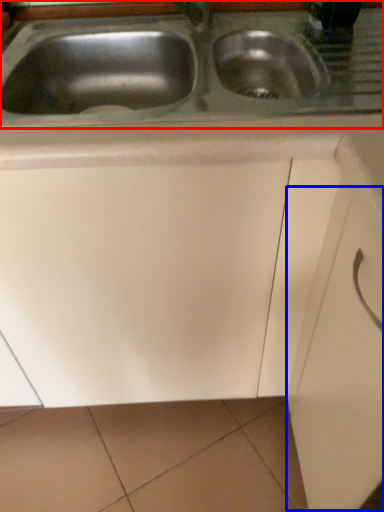
Question: Which of the following is the farthest to the observer, sink (highlighted by a red box) or drawer (highlighted by a blue box)?

Choices:
 (A) sink
 (B) drawer

Answer: (A)